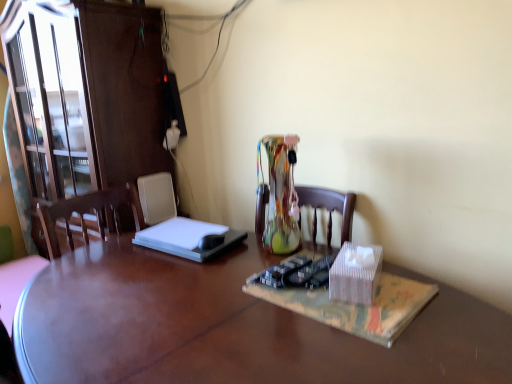
At what (x,y) coordinates should I click in order to perform the action: click on wooden desk at center. Please return your answer as a coordinate pair (x, y). The width and height of the screenshot is (512, 384). Looking at the image, I should click on (231, 327).

From a real-world perspective, is wooden desk at center located higher than white cardboard box at center?

Actually, wooden desk at center is physically below white cardboard box at center in the real world.

The width and height of the screenshot is (512, 384). Identify the location of cardboard box located above the wooden desk at center (from a real-world perspective). (x=355, y=273).

Who is taller, wooden desk at center or white cardboard box at center?

wooden desk at center is taller.

Is wooden desk at center completely or partially outside of white cardboard box at center?

Yes.

In the image, is white cardboard box at center on the left side or the right side of wooden desk at center?

From the image, it's evident that white cardboard box at center is to the right of wooden desk at center.

Who is more distant, white cardboard box at center or wooden desk at center?

Positioned behind is white cardboard box at center.

Is wooden desk at center located within white cardboard box at center?

That's incorrect, wooden desk at center is not inside white cardboard box at center.

Is matte brown cabinet at left oriented towards translucent plastic book at center?

No, matte brown cabinet at left is not turned towards translucent plastic book at center.

Identify the location of cabinetry on the left of the translucent plastic book at center. The width and height of the screenshot is (512, 384). (86, 94).

Considering the sizes of objects matte brown cabinet at left and translucent plastic book at center in the image provided, who is smaller, matte brown cabinet at left or translucent plastic book at center?

translucent plastic book at center is smaller.

Does white cardboard box at center lie behind matte brown cabinet at left?

That is False.

Considering the sizes of objects white cardboard box at center and matte brown cabinet at left in the image provided, who is taller, white cardboard box at center or matte brown cabinet at left?

Standing taller between the two is matte brown cabinet at left.

Considering the sizes of objects white cardboard box at center and matte brown cabinet at left in the image provided, who is bigger, white cardboard box at center or matte brown cabinet at left?

matte brown cabinet at left.

Identify the location of cardboard box on the right of the matte brown cabinet at left. (355, 273).

How far apart are wooden desk at center and matte brown cabinet at left?

The distance of wooden desk at center from matte brown cabinet at left is 33.55 inches.

From the picture: Considering the relative positions of wooden desk at center and matte brown cabinet at left in the image provided, is wooden desk at center in front of matte brown cabinet at left?

Yes, wooden desk at center is closer to the viewer.

How different are the orientations of wooden desk at center and matte brown cabinet at left in degrees?

They differ by 1.39 degrees in their facing directions.

Can you confirm if wooden desk at center is taller than matte brown cabinet at left?

Incorrect, the height of wooden desk at center is not larger of that of matte brown cabinet at left.

In terms of width, does translucent plastic book at center look wider or thinner when compared to matte brown cabinet at left?

In the image, translucent plastic book at center appears to be more narrow than matte brown cabinet at left.

Is point (362, 331) behind point (101, 185)?

No, (362, 331) is in front of (101, 185).

Considering the relative positions of translucent plastic book at center and matte brown cabinet at left in the image provided, is translucent plastic book at center to the left of matte brown cabinet at left from the viewer's perspective?

Incorrect, translucent plastic book at center is not on the left side of matte brown cabinet at left.

Between translucent plastic book at center and matte brown cabinet at left, which one is positioned in front?

translucent plastic book at center is in front.

From a real-world perspective, is white cardboard box at center positioned above or below translucent plastic book at center?

Clearly, from a real-world perspective, white cardboard box at center is above translucent plastic book at center.

Find the location of a particular element. The height and width of the screenshot is (384, 512). book that is below the white cardboard box at center (from the image's perspective) is located at coordinates (354, 306).

Is white cardboard box at center directly adjacent to translucent plastic book at center?

Yes, white cardboard box at center is touching translucent plastic book at center.

Which is farther, (345, 292) or (389, 283)?

Point (389, 283)

Find the location of a particular element. This screenshot has width=512, height=384. cardboard box above the wooden desk at center (from a real-world perspective) is located at coordinates (355, 273).

Image resolution: width=512 pixels, height=384 pixels. I want to click on desk on the left side of white cardboard box at center, so click(x=231, y=327).

Looking at the image, which one is located further to wooden desk at center, white cardboard box at center or translucent plastic book at center?

white cardboard box at center.

Which object lies nearer to the anchor point white cardboard box at center, wooden desk at center or matte brown cabinet at left?

The object closer to white cardboard box at center is wooden desk at center.

Considering their positions, is matte brown cabinet at left positioned further to wooden desk at center than translucent plastic book at center?

matte brown cabinet at left lies further to wooden desk at center than the other object.

Estimate the real-world distances between objects in this image. Which object is further from translucent plastic book at center, wooden desk at center or white cardboard box at center?

Based on the image, wooden desk at center appears to be further to translucent plastic book at center.

When comparing their distances from translucent plastic book at center, does wooden desk at center or matte brown cabinet at left seem further?

matte brown cabinet at left is further to translucent plastic book at center.

When comparing their distances from white cardboard box at center, does translucent plastic book at center or matte brown cabinet at left seem closer?

translucent plastic book at center.

Looking at the image, which one is located closer to white cardboard box at center, matte brown cabinet at left or translucent plastic book at center?

translucent plastic book at center is closer to white cardboard box at center.

From the image, which object appears to be nearer to white cardboard box at center, matte brown cabinet at left or wooden desk at center?

wooden desk at center lies closer to white cardboard box at center than the other object.

This screenshot has width=512, height=384. What are the coordinates of `book between wooden desk at center and matte brown cabinet at left along the z-axis` in the screenshot? It's located at (354, 306).

Find the location of a particular element. book between matte brown cabinet at left and white cardboard box at center in the horizontal direction is located at coordinates (354, 306).

Locate an element on the screen. This screenshot has width=512, height=384. desk situated between matte brown cabinet at left and white cardboard box at center from left to right is located at coordinates (231, 327).

You are a GUI agent. You are given a task and a screenshot of the screen. Output one action in this format:
    pyautogui.click(x=<x>, y=<y>)
    Task: Click on the book positioned between wooden desk at center and white cardboard box at center from near to far
    This screenshot has height=384, width=512.
    Given the screenshot: What is the action you would take?
    pyautogui.click(x=354, y=306)